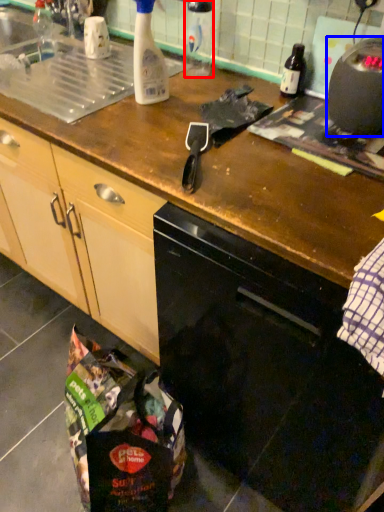
Question: Which object is closer to the camera taking this photo, bottle (highlighted by a red box) or kitchen appliance (highlighted by a blue box)?

Choices:
 (A) bottle
 (B) kitchen appliance

Answer: (B)